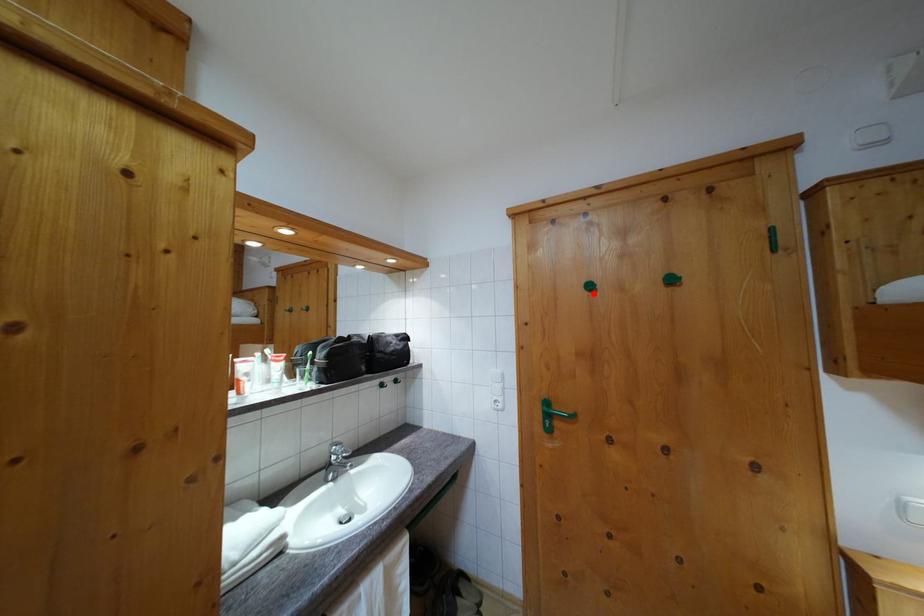
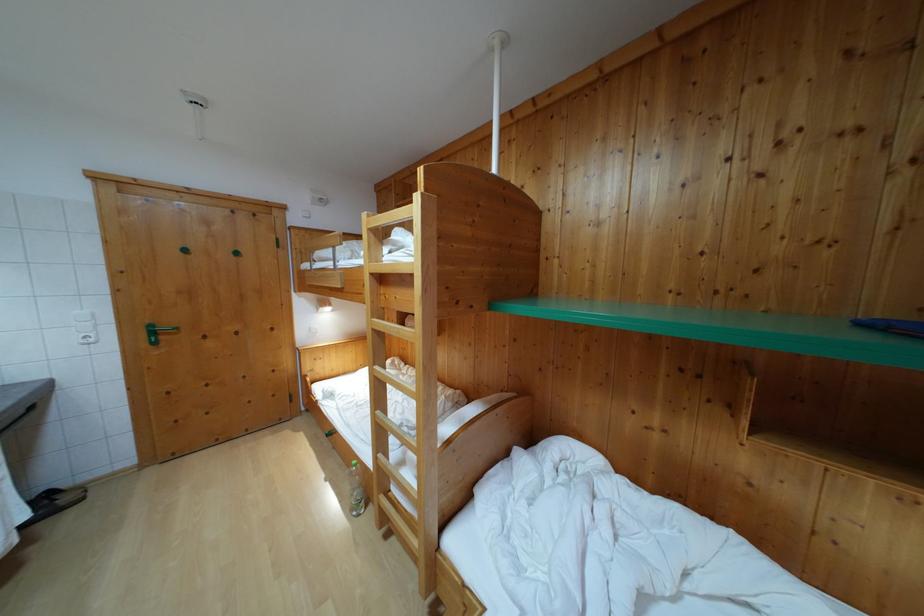
Find the pixel in the second image that matches the highlighted location in the first image.

(189, 257)